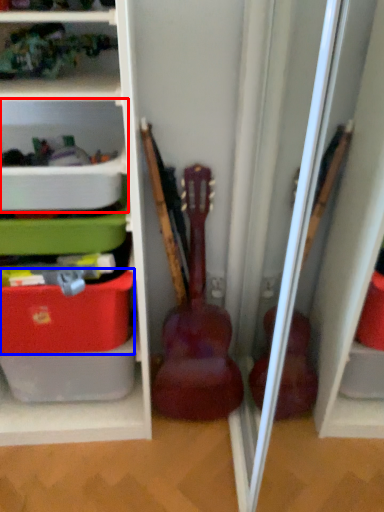
Question: Which object appears farthest to the camera in this image, shelf (highlighted by a red box) or storage box (highlighted by a blue box)?

Choices:
 (A) shelf
 (B) storage box

Answer: (B)